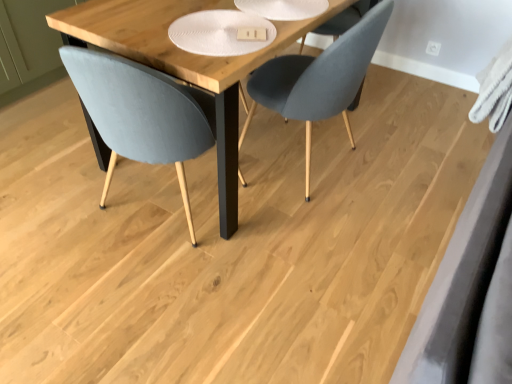
Question: Is wooden table at center positioned in front of velvet grey chair at center, the first chair in the right-to-left sequence?

Choices:
 (A) no
 (B) yes

Answer: (B)

Question: Can you confirm if wooden table at center is bigger than velvet grey chair at center, the first chair in the right-to-left sequence?

Choices:
 (A) no
 (B) yes

Answer: (B)

Question: Is wooden table at center not near velvet grey chair at center, acting as the second chair starting from the left?

Choices:
 (A) yes
 (B) no

Answer: (B)

Question: Does wooden table at center have a smaller size compared to velvet grey chair at center, acting as the second chair starting from the left?

Choices:
 (A) no
 (B) yes

Answer: (A)

Question: Considering the relative sizes of wooden table at center and velvet grey chair at center, acting as the second chair starting from the left, in the image provided, is wooden table at center wider than velvet grey chair at center, acting as the second chair starting from the left,?

Choices:
 (A) yes
 (B) no

Answer: (A)

Question: Is wooden table at center facing towards velvet grey chair at center, the first chair in the right-to-left sequence?

Choices:
 (A) yes
 (B) no

Answer: (A)

Question: Is velvet grey chair at center, the first chair in the right-to-left sequence, facing away from wooden table at center?

Choices:
 (A) no
 (B) yes

Answer: (B)

Question: Is velvet grey chair at center, the first chair in the right-to-left sequence, directly adjacent to wooden table at center?

Choices:
 (A) no
 (B) yes

Answer: (A)

Question: From the image's perspective, does velvet grey chair at center, acting as the second chair starting from the left, appear higher than wooden table at center?

Choices:
 (A) no
 (B) yes

Answer: (A)

Question: Does velvet grey chair at center, the first chair in the right-to-left sequence, have a greater height compared to wooden table at center?

Choices:
 (A) yes
 (B) no

Answer: (A)

Question: Can you confirm if velvet grey chair at center, the first chair in the right-to-left sequence, is positioned to the left of wooden table at center?

Choices:
 (A) no
 (B) yes

Answer: (A)

Question: Considering the relative sizes of velvet grey chair at center, the first chair in the right-to-left sequence, and wooden table at center in the image provided, is velvet grey chair at center, the first chair in the right-to-left sequence, thinner than wooden table at center?

Choices:
 (A) yes
 (B) no

Answer: (A)

Question: Is velvet grey chair at center, the first chair in the right-to-left sequence, not inside matte gray chair at left, which is the second chair from right to left?

Choices:
 (A) no
 (B) yes

Answer: (B)